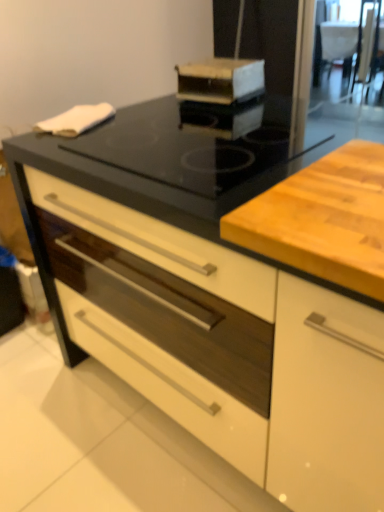
Find the location of a particular element. The width and height of the screenshot is (384, 512). vacant area that lies in front of wooden box at upper center is located at coordinates (214, 112).